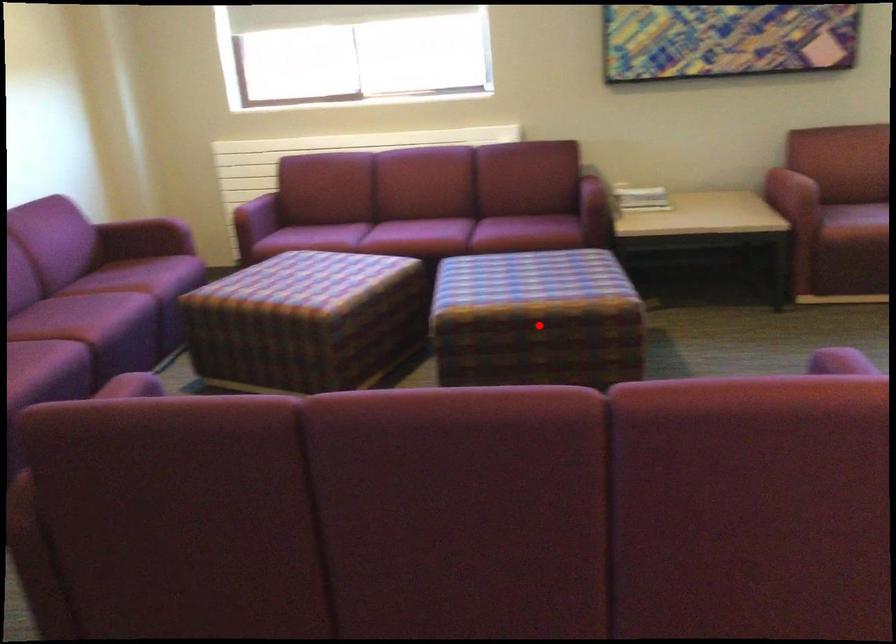
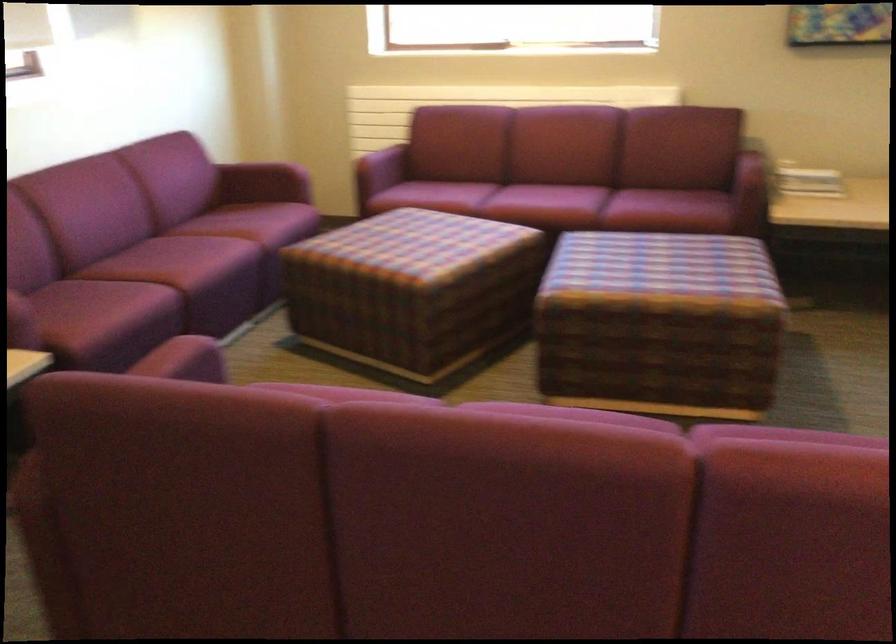
Question: I am providing you with two images of the same scene from different viewpoints. Image1 has a red point marked. In image2, the corresponding 3D location appears at what relative position? Reply with the corresponding letter.

Choices:
 (A) Closer
 (B) Farther

Answer: (A)